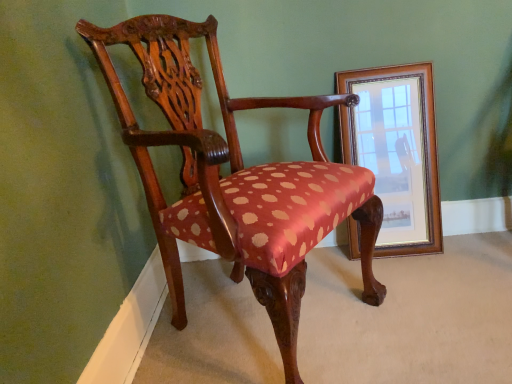
At what (x,y) coordinates should I click in order to perform the action: click on vacant area that is situated to the right of polished wood chair at center. Please return your answer as a coordinate pair (x, y). This screenshot has width=512, height=384. Looking at the image, I should click on (426, 306).